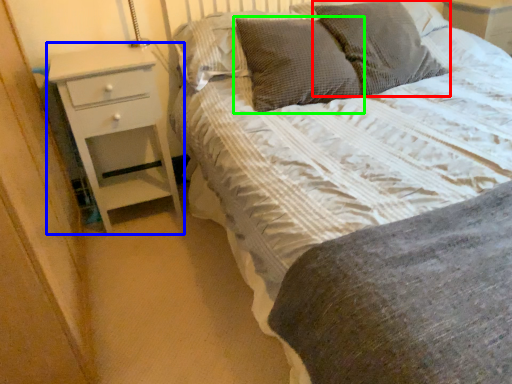
Question: Which object is positioned closest to pillow (highlighted by a red box)? Select from chest of drawers (highlighted by a blue box) and pillow (highlighted by a green box).

Choices:
 (A) chest of drawers
 (B) pillow

Answer: (B)